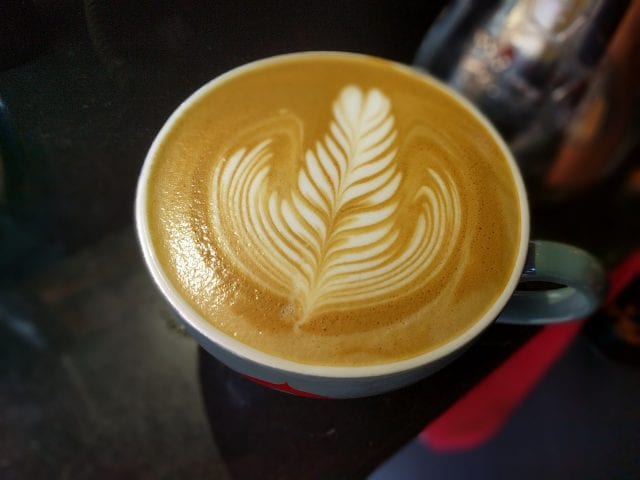
The width and height of the screenshot is (640, 480). Identify the location of bottom table. (262, 428).